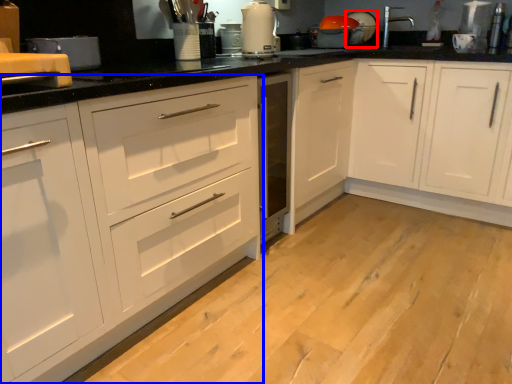
Question: Among these objects, which one is nearest to the camera, appliance (highlighted by a red box) or cabinetry (highlighted by a blue box)?

Choices:
 (A) appliance
 (B) cabinetry

Answer: (B)